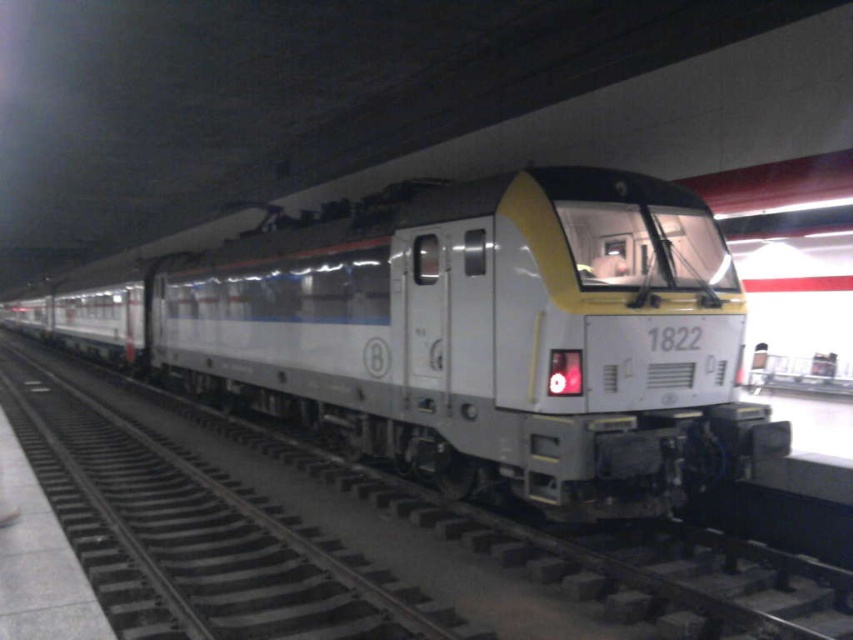
Question: Does silver metallic train at center lie behind metallic track at center?

Choices:
 (A) yes
 (B) no

Answer: (A)

Question: Which object appears closest to the camera in this image?

Choices:
 (A) silver metallic train at center
 (B) metallic track at center

Answer: (B)

Question: Which point is farther to the camera?

Choices:
 (A) coord(424,358)
 (B) coord(22,442)

Answer: (B)

Question: Does silver metallic train at center lie behind metallic track at center?

Choices:
 (A) yes
 (B) no

Answer: (A)

Question: Does silver metallic train at center have a larger size compared to metallic track at center?

Choices:
 (A) no
 (B) yes

Answer: (B)